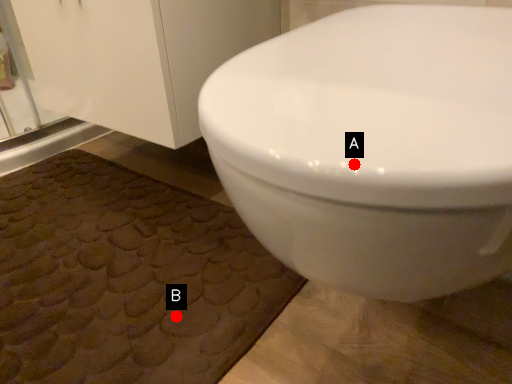
Question: Two points are circled on the image, labeled by A and B beside each circle. Which of the following is the farthest from the observer?

Choices:
 (A) A is further
 (B) B is further

Answer: (B)